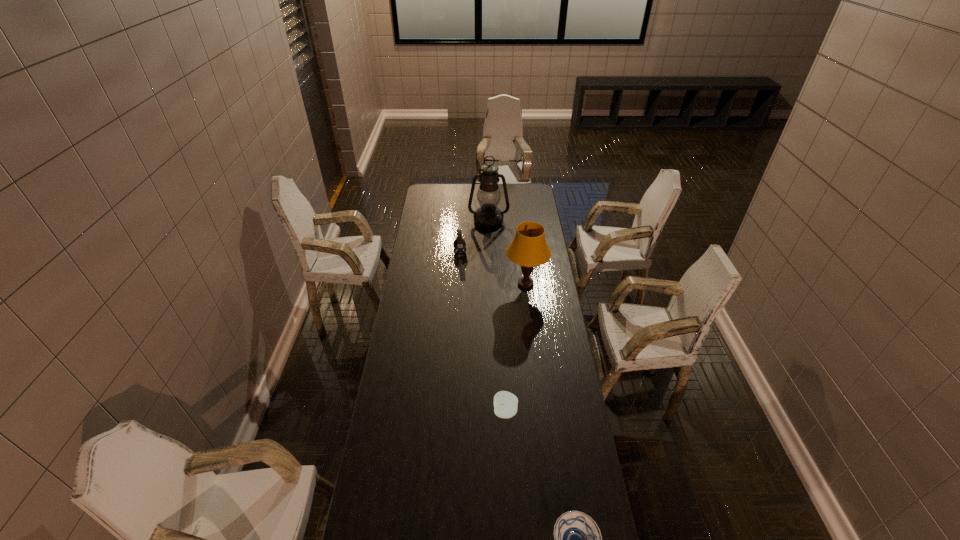
Where is `free space that satisfies the following two spatial constraints: 1. on the ear cups of the second farthest object; 2. on the left side of the fourth farthest object`? Image resolution: width=960 pixels, height=540 pixels. free space that satisfies the following two spatial constraints: 1. on the ear cups of the second farthest object; 2. on the left side of the fourth farthest object is located at coordinates (451, 412).

Locate an element on the screen. free point that satisfies the following two spatial constraints: 1. on the ear cups of the headset; 2. on the back side of the apple is located at coordinates coord(451,412).